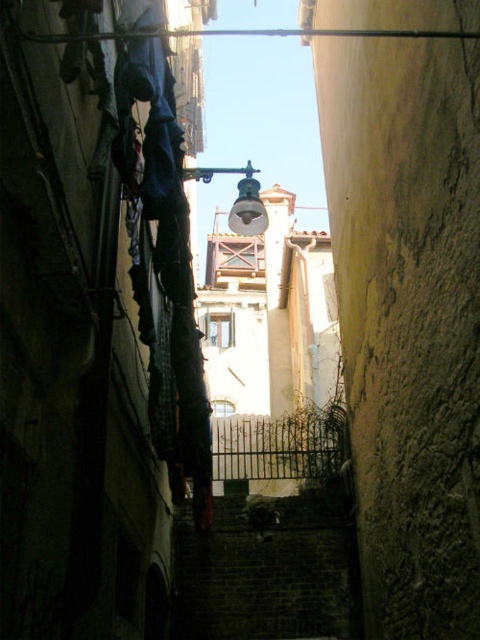
Can you confirm if dark brick stairwell at center is positioned to the right of metallic glass at upper center?

Indeed, dark brick stairwell at center is positioned on the right side of metallic glass at upper center.

Does dark brick stairwell at center have a smaller size compared to metallic glass at upper center?

Yes, dark brick stairwell at center is smaller than metallic glass at upper center.

Who is more distant from viewer, (x=189, y=634) or (x=195, y=168)?

The point (x=189, y=634) is behind.

Image resolution: width=480 pixels, height=640 pixels. Identify the location of dark brick stairwell at center. (268, 570).